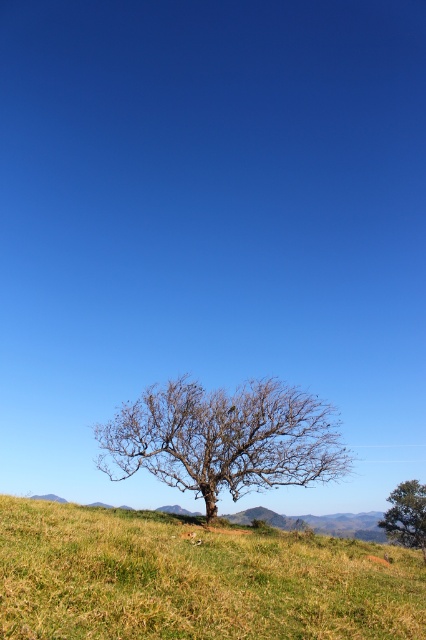
You are planning to set up a small tent for a camping trip. Based on the scene, which area would be more suitable for the tent considering space requirements? Please choose between the green grassy hillside at lower center and the green leafy tree at center.

The green grassy hillside at lower center is more suitable for setting up a tent because its width surpasses that of the green leafy tree at center, providing more space.

You are standing at the base of the green leafy tree at center and want to walk to the green grassy hillside at lower center. Which direction should you head?

You should head to the left because the green grassy hillside at lower center is located to the left of the green leafy tree at center.

You are standing at the camera position and want to reach the point marked at coordinates (187, 545). If you walk straight toward it, how far will you have to walk?

You will have to walk 39.25 feet to reach the point marked at coordinates (187, 545) from the camera position.